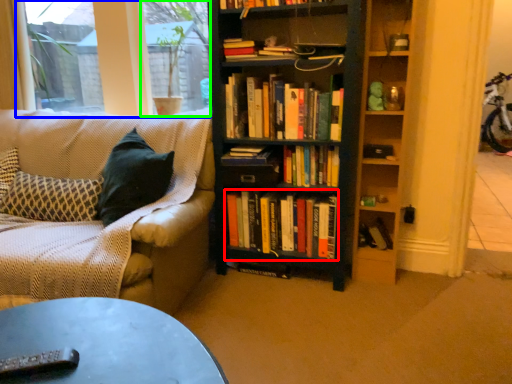
Question: Based on their relative distances, which object is farther from book (highlighted by a red box)? Choose from window screen (highlighted by a blue box) and window screen (highlighted by a green box).

Choices:
 (A) window screen
 (B) window screen

Answer: (A)